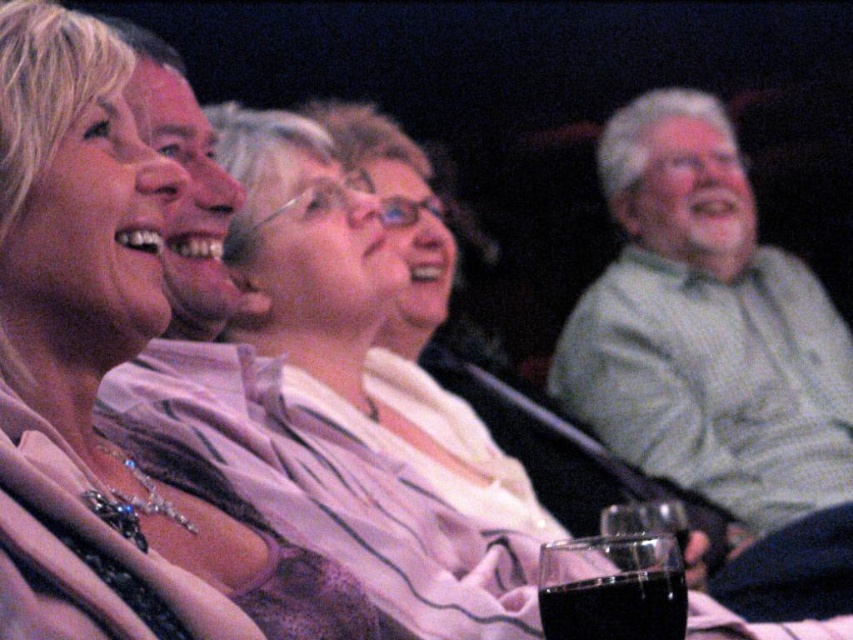
Does green textured shirt at right appear over black glass at lower center?

Yes.

Can you confirm if green textured shirt at right is smaller than black glass at lower center?

No, green textured shirt at right is not smaller than black glass at lower center.

Locate an element on the screen. green textured shirt at right is located at coordinates (706, 326).

Is matte black face at upper left taller than black glass at lower center?

Correct, matte black face at upper left is much taller as black glass at lower center.

Who is higher up, matte black face at upper left or black glass at lower center?

matte black face at upper left is higher up.

You are a GUI agent. You are given a task and a screenshot of the screen. Output one action in this format:
    pyautogui.click(x=<x>, y=<y>)
    Task: Click on the matte black face at upper left
    
    Given the screenshot: What is the action you would take?
    pyautogui.click(x=189, y=188)

This screenshot has width=853, height=640. I want to click on matte black face at upper left, so (x=189, y=188).

Based on the photo, does matte silver necklace at upper left appear on the right side of matte black face at upper left?

Indeed, matte silver necklace at upper left is positioned on the right side of matte black face at upper left.

Between matte silver necklace at upper left and matte black face at upper left, which one has less height?

matte black face at upper left

The height and width of the screenshot is (640, 853). Identify the location of matte silver necklace at upper left. (77, 339).